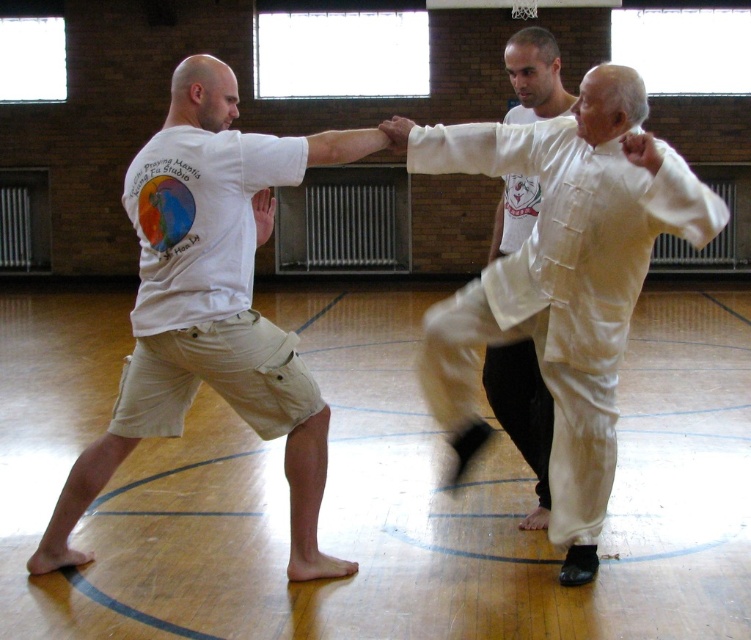
Question: Which of the following is the closest to the observer?

Choices:
 (A) (602, 86)
 (B) (103, 474)

Answer: (A)

Question: Which object is farther from the camera taking this photo?

Choices:
 (A) white silk pants at right
 (B) white silk shirt at center
 (C) white cotton t-shirt at center

Answer: (B)

Question: Is white silk pants at right further to the viewer compared to white silk shirt at center?

Choices:
 (A) yes
 (B) no

Answer: (B)

Question: Among these objects, which one is nearest to the camera?

Choices:
 (A) white cotton t-shirt at center
 (B) white silk pants at right
 (C) white silk shirt at center

Answer: (B)

Question: From the image, what is the correct spatial relationship of white cotton t-shirt at center in relation to white silk shirt at center?

Choices:
 (A) above
 (B) below

Answer: (A)

Question: Is white silk pants at right to the right of white silk shirt at center from the viewer's perspective?

Choices:
 (A) yes
 (B) no

Answer: (B)